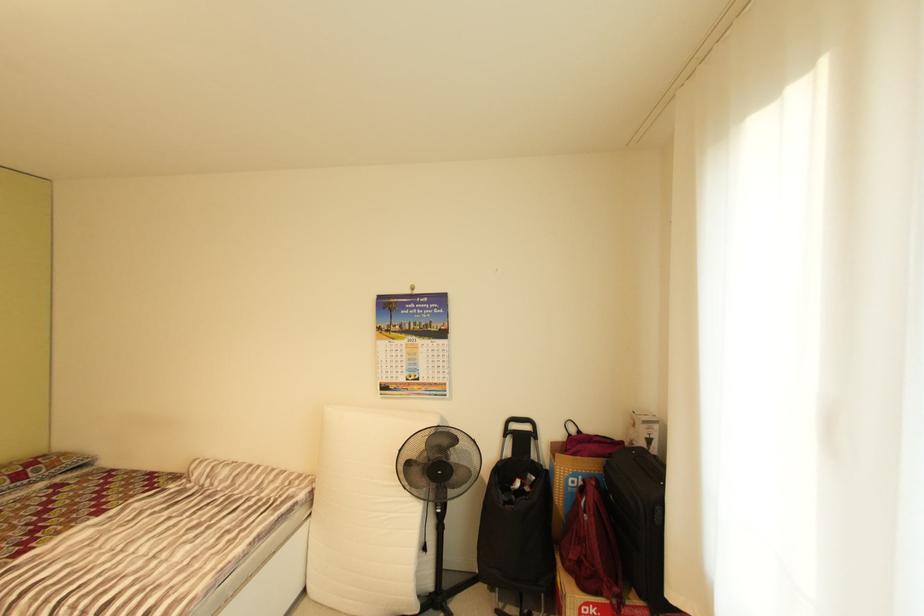
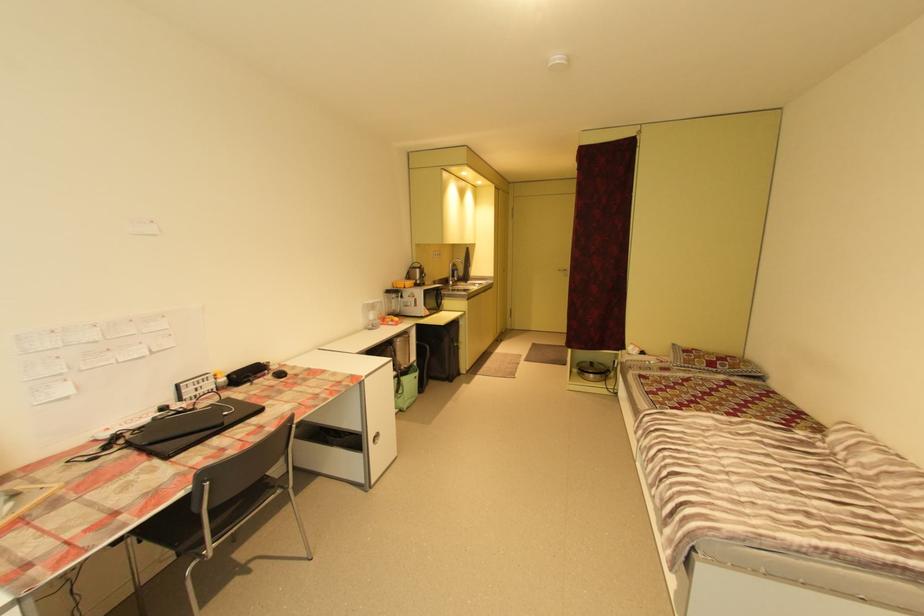
Question: The camera is either moving clockwise (left) or counter-clockwise (right) around the object. The first image is from the beginning of the video and the second image is from the end. Is the camera moving left or right when shooting the video?

Choices:
 (A) Left
 (B) Right

Answer: (B)